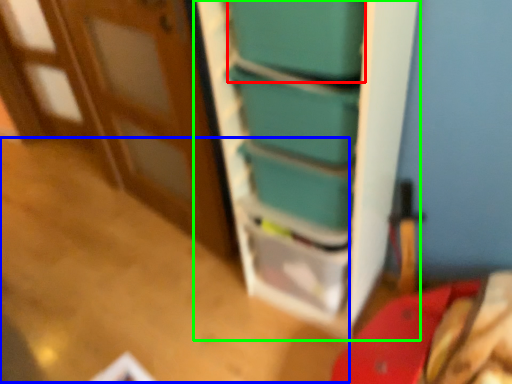
Question: Which object is positioned farthest from box (highlighted by a red box)? Select from table (highlighted by a blue box) and bookshelf (highlighted by a green box).

Choices:
 (A) table
 (B) bookshelf

Answer: (A)